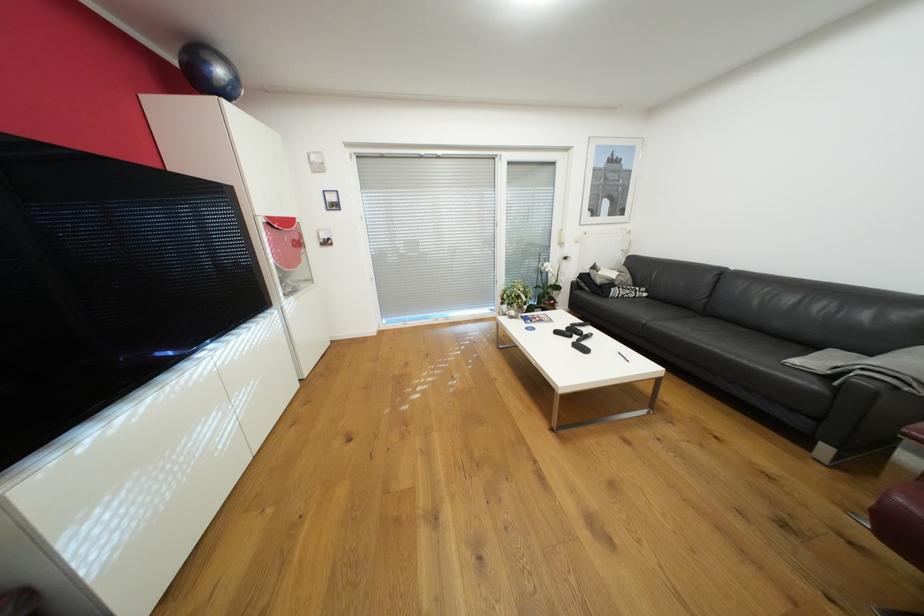
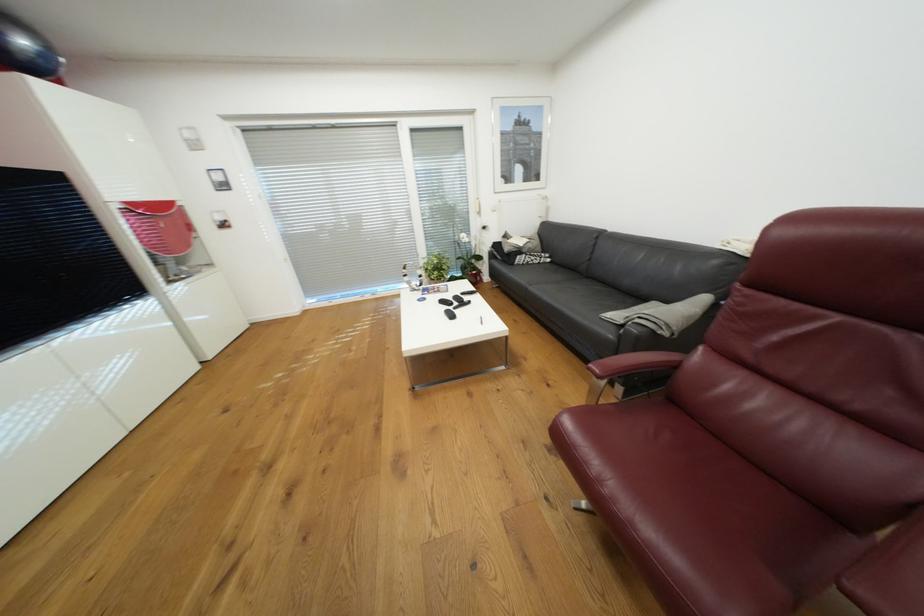
Question: Which direction would the cameraman need to move to produce the second image? Reply with the corresponding letter.

Choices:
 (A) Left
 (B) Right
 (C) Forward
 (D) Backward

Answer: (B)